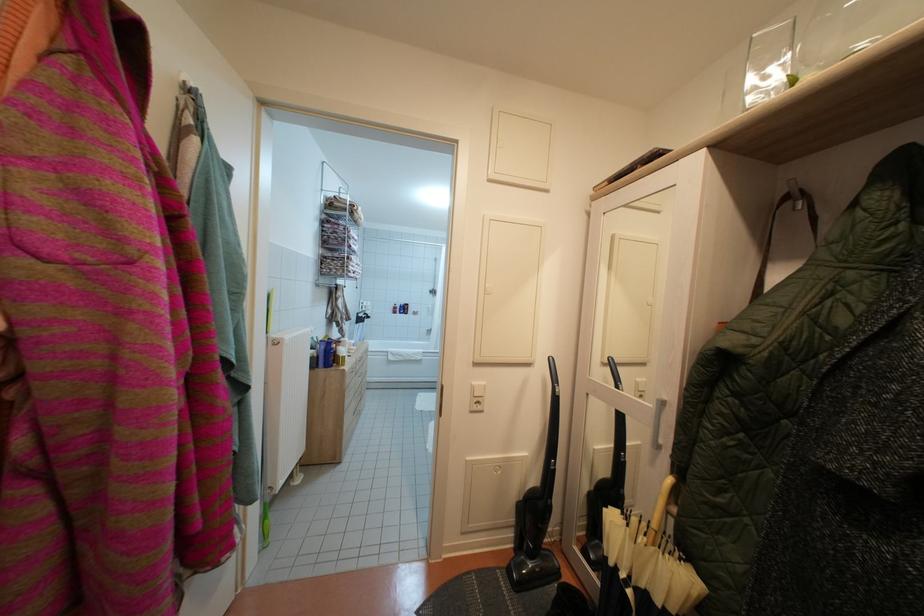
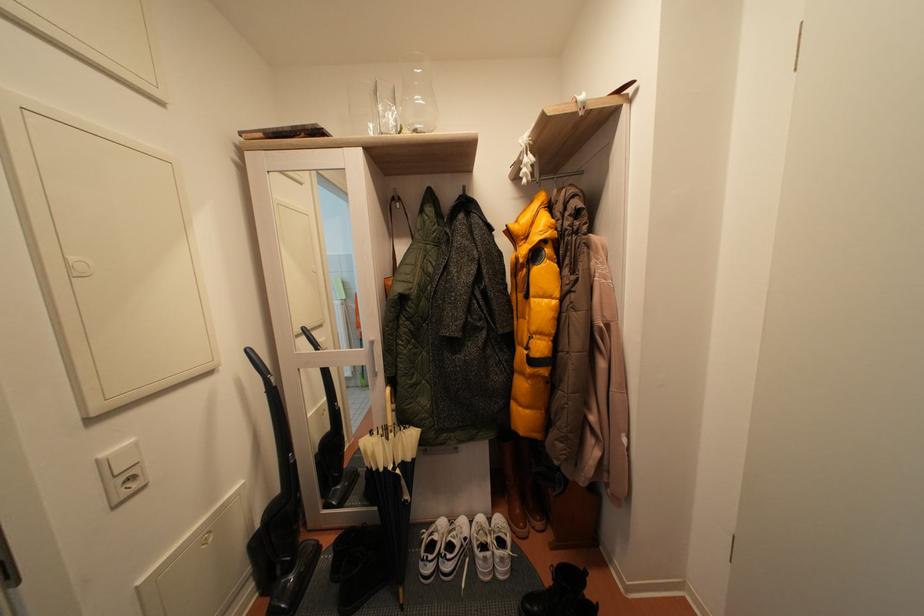
Question: The camera is either moving clockwise (left) or counter-clockwise (right) around the object. The first image is from the beginning of the video and the second image is from the end. Is the camera moving left or right when shooting the video?

Choices:
 (A) Left
 (B) Right

Answer: (A)